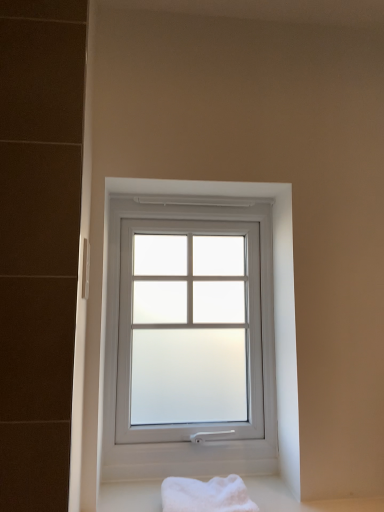
Locate an element on the screen. The width and height of the screenshot is (384, 512). vacant space situated above white soft bath towel at lower center (from a real-world perspective) is located at coordinates coord(202,487).